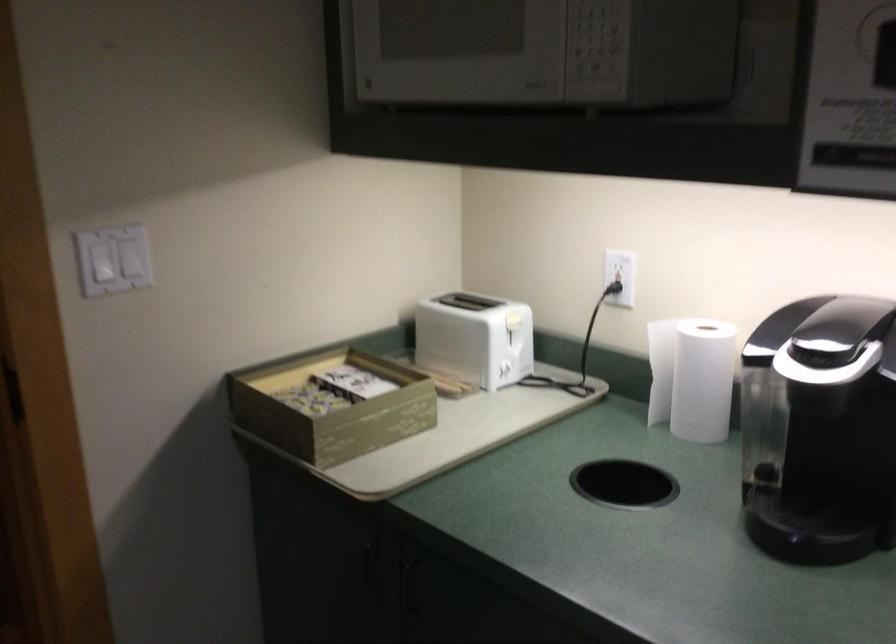
Locate an element on the screen. coffee maker reservoir is located at coordinates click(839, 458).